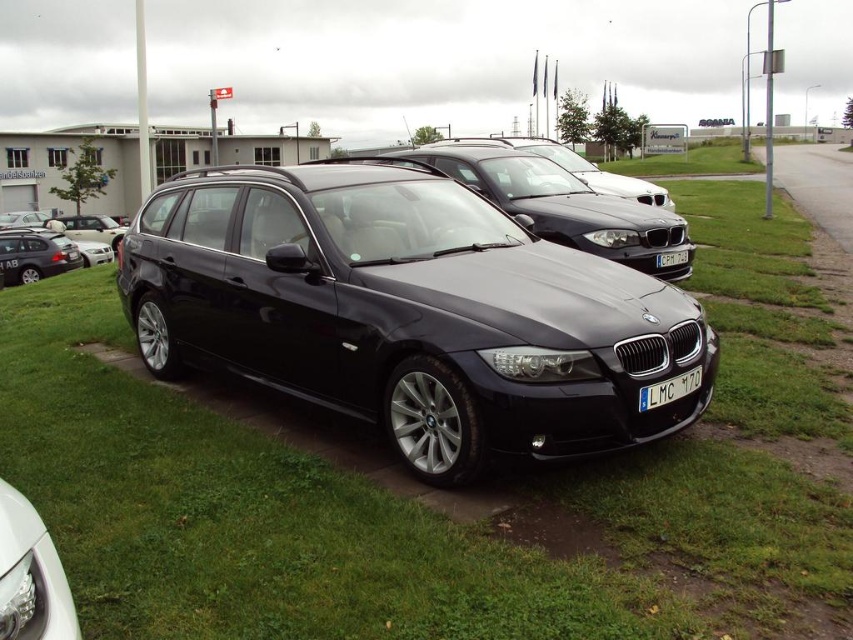
Can you confirm if matte black car at center is bigger than black plastic license plate at center?

Yes, matte black car at center is bigger than black plastic license plate at center.

Is point (68, 221) closer to viewer compared to point (672, 257)?

That is False.

Which is in front, point (96, 218) or point (664, 259)?

Point (664, 259)

At what (x,y) coordinates should I click in order to perform the action: click on matte black car at center. Please return your answer as a coordinate pair (x, y). The width and height of the screenshot is (853, 640). Looking at the image, I should click on (91, 228).

This screenshot has height=640, width=853. Identify the location of gravel road at right. (817, 186).

Can you confirm if gravel road at right is positioned to the left of matte black car at left?

In fact, gravel road at right is to the right of matte black car at left.

Where is `gravel road at right`? gravel road at right is located at coordinates (817, 186).

Does glossy white headlight at lower left appear on the right side of white plastic license plate at center?

No, glossy white headlight at lower left is not to the right of white plastic license plate at center.

Which is more to the left, glossy white headlight at lower left or white plastic license plate at center?

glossy white headlight at lower left

Is point (73, 630) farther from viewer compared to point (694, 369)?

No, it is in front of (694, 369).

At what (x,y) coordinates should I click in order to perform the action: click on glossy white headlight at lower left. Please return your answer as a coordinate pair (x, y). Looking at the image, I should click on (30, 576).